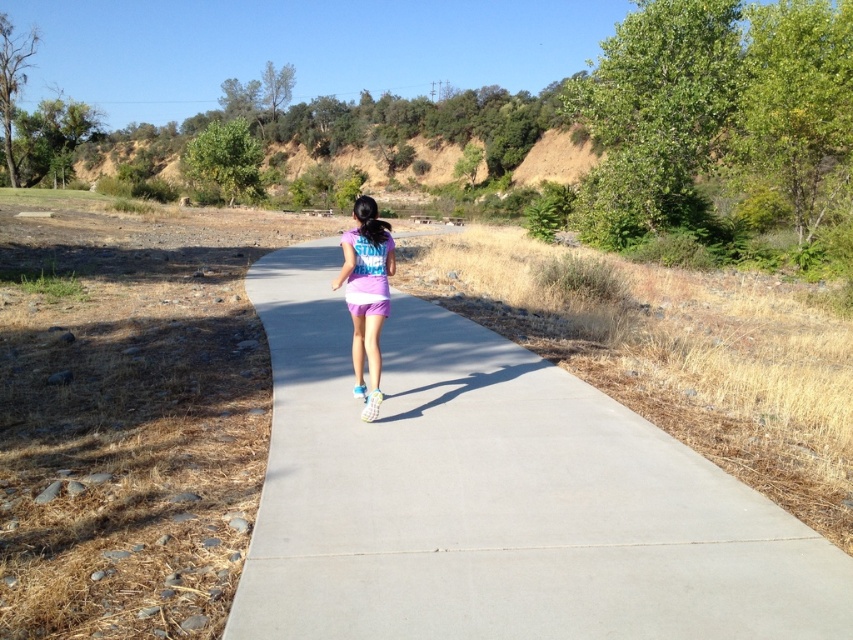
Question: Can you confirm if gray concrete pavement at center is positioned to the right of purple fabric shorts at center?

Choices:
 (A) no
 (B) yes

Answer: (B)

Question: In this image, where is gray concrete pavement at center located relative to purple fabric shorts at center?

Choices:
 (A) above
 (B) below

Answer: (B)

Question: Considering the relative positions of gray concrete pavement at center and purple fabric shorts at center in the image provided, where is gray concrete pavement at center located with respect to purple fabric shorts at center?

Choices:
 (A) right
 (B) left

Answer: (A)